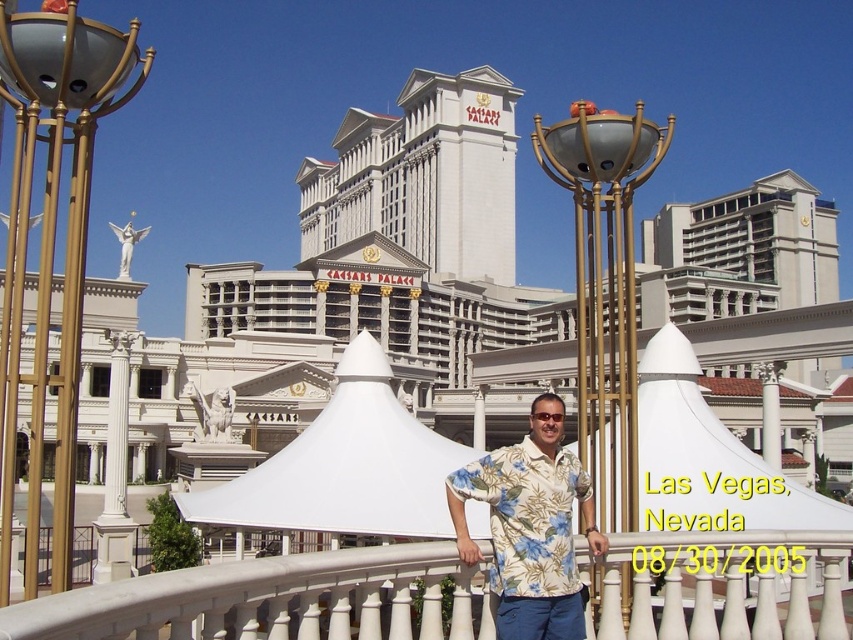
From the picture: You are a photographer at Caesars Palace and need to set up a tripod to capture the man on the white glossy rail at center. Since the white fabric canopy at center is overhead, will sunlight reach the rail area?

The white glossy rail at center is positioned under the white fabric canopy at center, so sunlight may be partially blocked by the canopy, reducing the amount of direct light reaching the rail area.

You are a guest at Caesars Palace and want to sit under the white fabric canopy at center to enjoy shade. However, there is a gold metallic lamp post at center above it. Will the lamp post block sunlight from reaching the canopy?

The white fabric canopy at center is positioned under the gold metallic lamp post at center, so the lamp post may block some sunlight from reaching the canopy, depending on the time of day and angle of the sun.